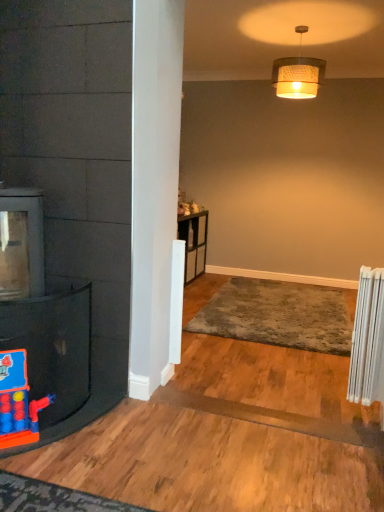
Question: Does gray plush rug at center have a lesser width compared to woven fabric lampshade at upper center?

Choices:
 (A) yes
 (B) no

Answer: (B)

Question: Is gray plush rug at center behind woven fabric lampshade at upper center?

Choices:
 (A) yes
 (B) no

Answer: (B)

Question: Considering the relative sizes of gray plush rug at center and woven fabric lampshade at upper center in the image provided, is gray plush rug at center bigger than woven fabric lampshade at upper center?

Choices:
 (A) no
 (B) yes

Answer: (B)

Question: From the image's perspective, is gray plush rug at center on woven fabric lampshade at upper center?

Choices:
 (A) no
 (B) yes

Answer: (A)

Question: From a real-world perspective, is gray plush rug at center on top of woven fabric lampshade at upper center?

Choices:
 (A) yes
 (B) no

Answer: (B)

Question: In terms of width, does gray plush rug at center look wider or thinner when compared to rubberized plastic toy at left?

Choices:
 (A) thin
 (B) wide

Answer: (B)

Question: From their relative heights in the image, would you say gray plush rug at center is taller or shorter than rubberized plastic toy at left?

Choices:
 (A) short
 (B) tall

Answer: (A)

Question: Visually, is gray plush rug at center positioned to the left or to the right of rubberized plastic toy at left?

Choices:
 (A) right
 (B) left

Answer: (A)

Question: Is gray plush rug at center inside the boundaries of rubberized plastic toy at left, or outside?

Choices:
 (A) inside
 (B) outside

Answer: (B)

Question: From a real-world perspective, is woven fabric lampshade at upper center above or below rubberized plastic toy at left?

Choices:
 (A) above
 (B) below

Answer: (A)

Question: Visually, is woven fabric lampshade at upper center positioned to the left or to the right of rubberized plastic toy at left?

Choices:
 (A) right
 (B) left

Answer: (A)

Question: Relative to rubberized plastic toy at left, is woven fabric lampshade at upper center in front or behind?

Choices:
 (A) front
 (B) behind

Answer: (B)

Question: Considering the positions of woven fabric lampshade at upper center and rubberized plastic toy at left in the image, is woven fabric lampshade at upper center bigger or smaller than rubberized plastic toy at left?

Choices:
 (A) small
 (B) big

Answer: (B)

Question: Is white plastic radiator at right to the left or to the right of gray plush rug at center in the image?

Choices:
 (A) right
 (B) left

Answer: (A)

Question: Is white plastic radiator at right taller or shorter than gray plush rug at center?

Choices:
 (A) short
 (B) tall

Answer: (B)